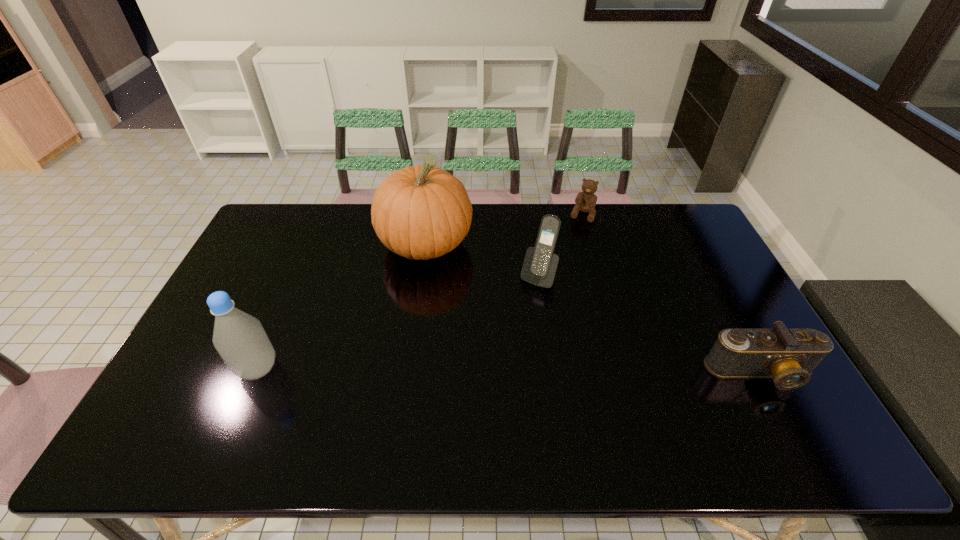
Where is `free space located 0.390m on the stem of the pumpkin`? free space located 0.390m on the stem of the pumpkin is located at coordinates (511, 359).

You are a GUI agent. You are given a task and a screenshot of the screen. Output one action in this format:
    pyautogui.click(x=<x>, y=<y>)
    Task: Click on the vacant region located 0.120m on the stem of the pumpkin
    The width and height of the screenshot is (960, 540).
    Given the screenshot: What is the action you would take?
    pyautogui.click(x=464, y=295)

Locate an element on the screen. Image resolution: width=960 pixels, height=540 pixels. free space located on the front-facing side of the third shortest object is located at coordinates (501, 341).

At what (x,y) coordinates should I click in order to perform the action: click on vacant space situated on the front-facing side of the third shortest object. Please return your answer as a coordinate pair (x, y). The image size is (960, 540). Looking at the image, I should click on (477, 383).

At what (x,y) coordinates should I click in order to perform the action: click on free location located on the front-facing side of the third shortest object. Please return your answer as a coordinate pair (x, y). Looking at the image, I should click on (520, 307).

This screenshot has height=540, width=960. I want to click on free space located on the face of the teddy bear, so click(x=574, y=236).

Find the location of a particular element. free space located 0.080m on the face of the teddy bear is located at coordinates (574, 236).

At what (x,y) coordinates should I click in order to perform the action: click on free location located on the face of the teddy bear. Please return your answer as a coordinate pair (x, y). Image resolution: width=960 pixels, height=540 pixels. Looking at the image, I should click on (564, 260).

Identify the location of pumpkin at the far edge. The width and height of the screenshot is (960, 540). (421, 212).

Where is `teddy bear present at the far edge`? Image resolution: width=960 pixels, height=540 pixels. teddy bear present at the far edge is located at coordinates (585, 201).